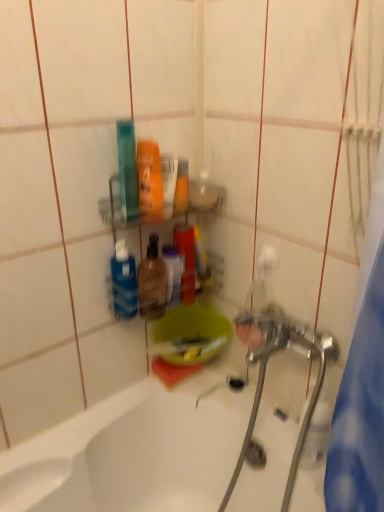
Question: Considering the relative sizes of metallic silver water pipe at lower right and white glossy bathtub at lower left in the image provided, is metallic silver water pipe at lower right wider than white glossy bathtub at lower left?

Choices:
 (A) yes
 (B) no

Answer: (B)

Question: Is metallic silver water pipe at lower right next to white glossy bathtub at lower left?

Choices:
 (A) yes
 (B) no

Answer: (B)

Question: Is metallic silver water pipe at lower right at the left side of white glossy bathtub at lower left?

Choices:
 (A) no
 (B) yes

Answer: (A)

Question: Is metallic silver water pipe at lower right positioned far away from white glossy bathtub at lower left?

Choices:
 (A) yes
 (B) no

Answer: (B)

Question: Is metallic silver water pipe at lower right closer to the viewer compared to white glossy bathtub at lower left?

Choices:
 (A) no
 (B) yes

Answer: (A)

Question: Can white glossy bathtub at lower left be found inside metallic silver water pipe at lower right?

Choices:
 (A) yes
 (B) no

Answer: (B)

Question: Would you say chrome metallic faucet at center contains blue matte bottle at center?

Choices:
 (A) yes
 (B) no

Answer: (B)

Question: Is chrome metallic faucet at center far away from blue matte bottle at center?

Choices:
 (A) no
 (B) yes

Answer: (A)

Question: From the image's perspective, is chrome metallic faucet at center on top of blue matte bottle at center?

Choices:
 (A) no
 (B) yes

Answer: (A)

Question: Is the depth of chrome metallic faucet at center less than that of blue matte bottle at center?

Choices:
 (A) yes
 (B) no

Answer: (A)

Question: Is chrome metallic faucet at center in contact with blue matte bottle at center?

Choices:
 (A) yes
 (B) no

Answer: (B)

Question: Considering the relative sizes of chrome metallic faucet at center and blue matte bottle at center in the image provided, is chrome metallic faucet at center thinner than blue matte bottle at center?

Choices:
 (A) yes
 (B) no

Answer: (B)

Question: Does metallic silver water pipe at lower right appear on the left side of translucent plastic bottle at center?

Choices:
 (A) yes
 (B) no

Answer: (B)